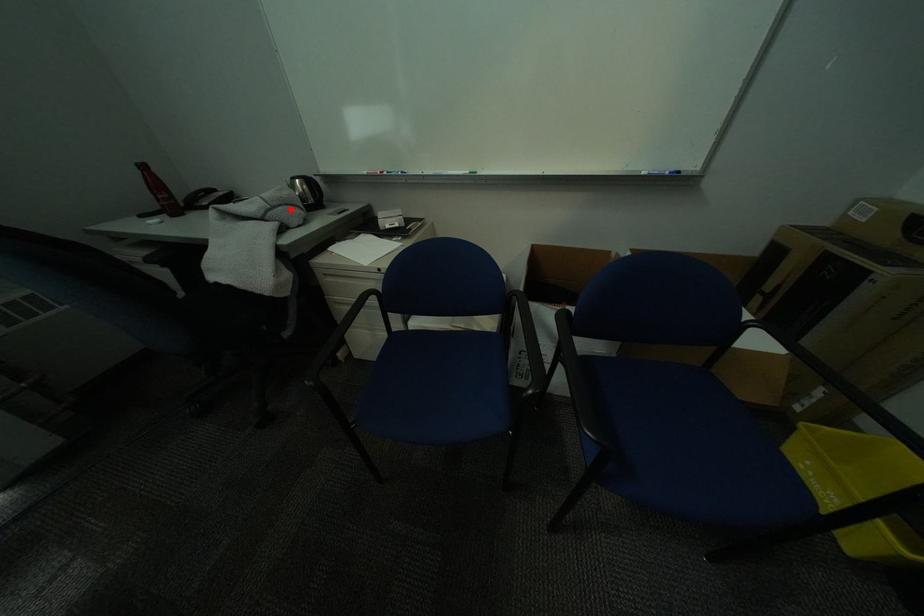
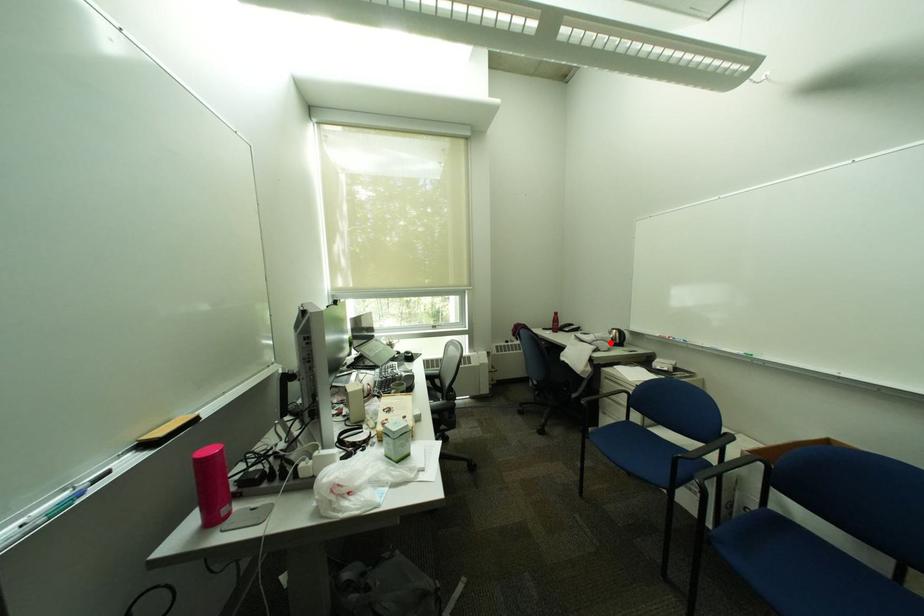
I am providing you with two images of the same scene from different viewpoints. A red point is marked on the first image and another point is marked on the second image. Is the marked point in image1 the same physical position as the marked point in image2?

Yes